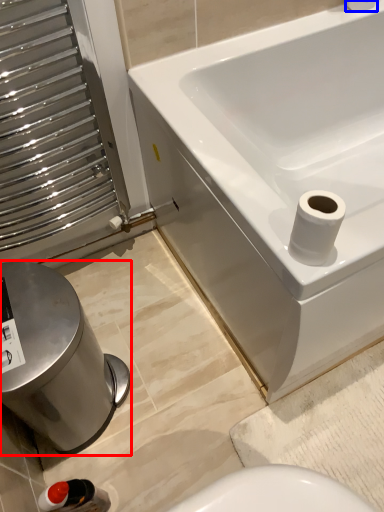
Question: Among these objects, which one is farthest to the camera, bidet (highlighted by a red box) or toilet paper (highlighted by a blue box)?

Choices:
 (A) bidet
 (B) toilet paper

Answer: (B)